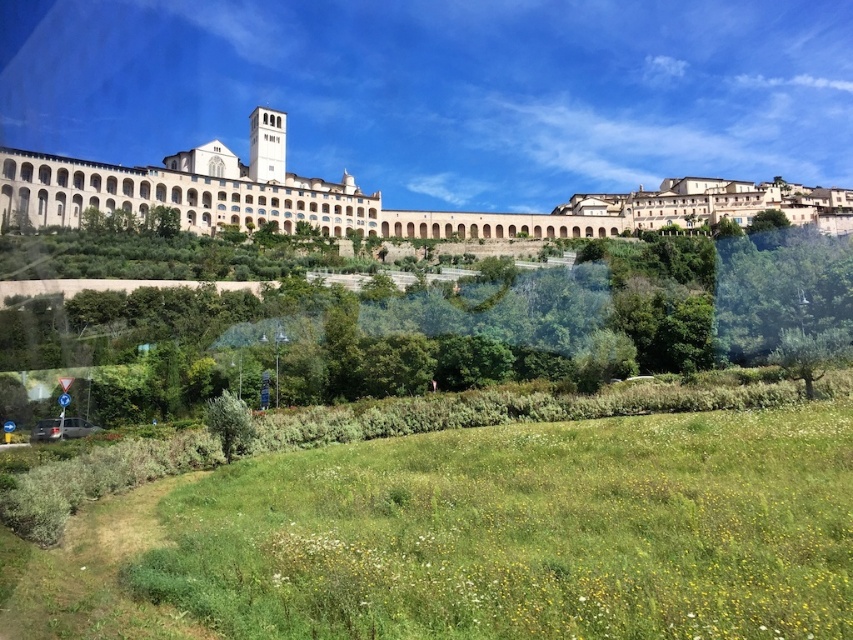
You are a visitor standing at the base of the hill looking up at the historic building. You notice the green grassy field at lower center and the green leafy tree at center. Which of these two features is positioned lower in the image?

The green grassy field at lower center is positioned lower than the green leafy tree at center in the image.

You are a landscape architect planning to install a new pathway. You need to determine which area has more space for a wider path between the green grassy field at lower center and the white stone building at upper center. Based on the scene, which area allows for a wider path?

The white stone building at upper center has a greater width than the green grassy field at lower center, so the wider path can be placed there.

You are standing at the base of the hill where the historic building is located. You want to walk towards the green grassy field at lower center. Which direction should you head to reach it?

The green grassy field at lower center is located at point coordinates of (480, 536), so you should head towards the lower center direction to reach it.